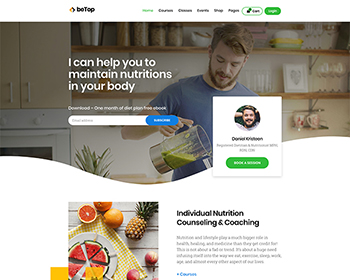
Where is `white plate`? Image resolution: width=350 pixels, height=280 pixels. white plate is located at coordinates (105, 240).